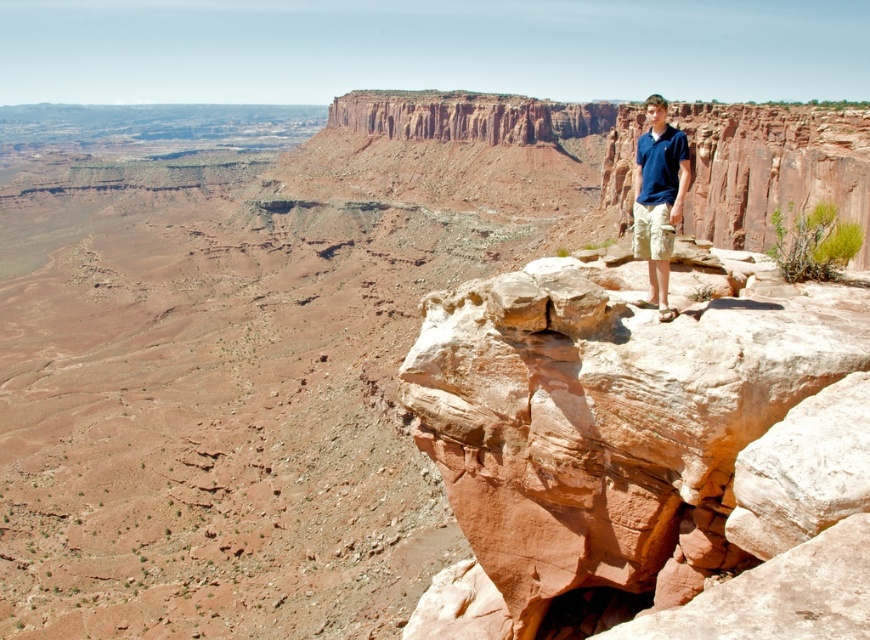
Is point (660, 404) in front of point (656, 230)?

Yes, point (660, 404) is closer to viewer.

Between rustic sandstone rock at upper right and blue cotton polo shirt at upper right, which one appears on the left side from the viewer's perspective?

rustic sandstone rock at upper right

I want to click on rustic sandstone rock at upper right, so click(601, 429).

Identify the location of rustic sandstone rock at upper right. The width and height of the screenshot is (870, 640). (601, 429).